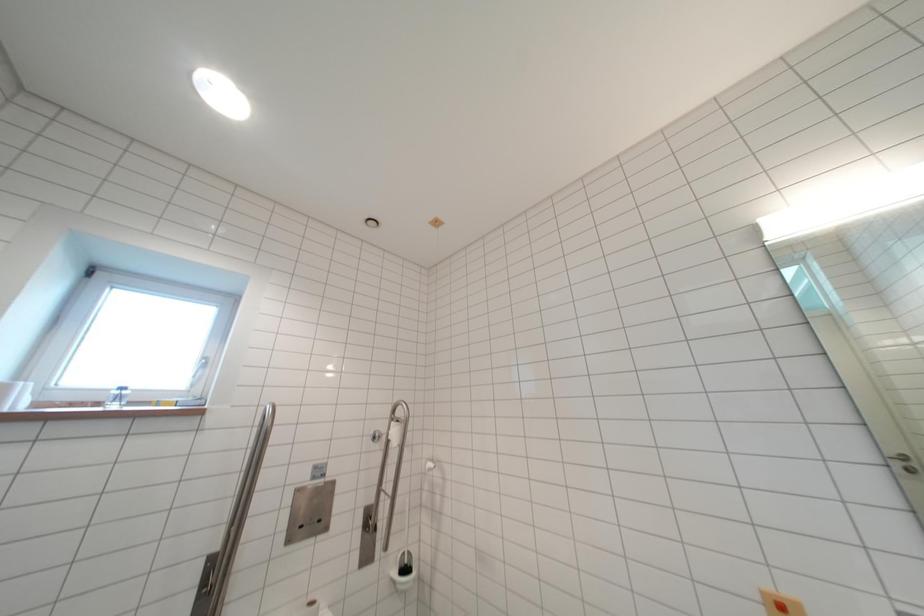
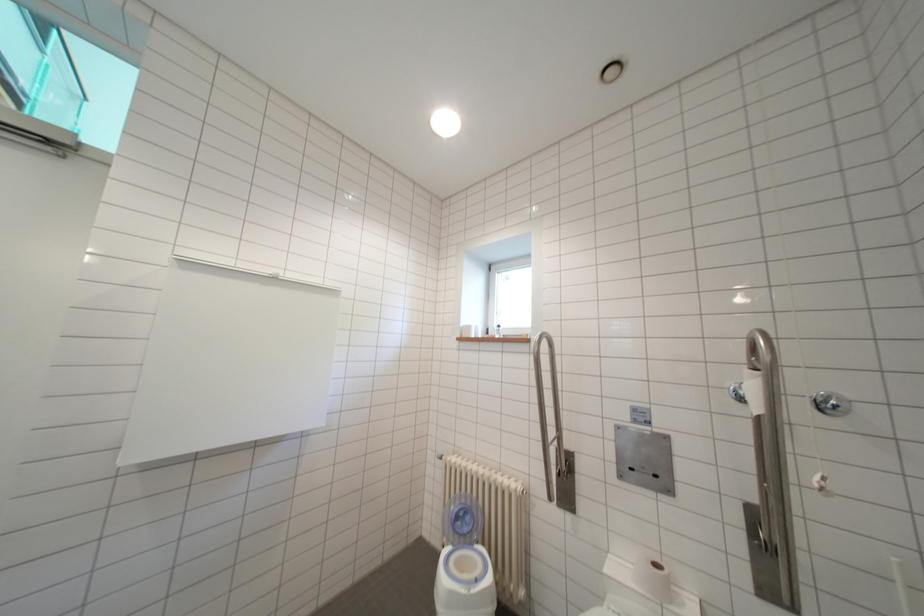
Question: How did the camera likely rotate?

Choices:
 (A) Left
 (B) Right
 (C) Up
 (D) Down

Answer: (A)